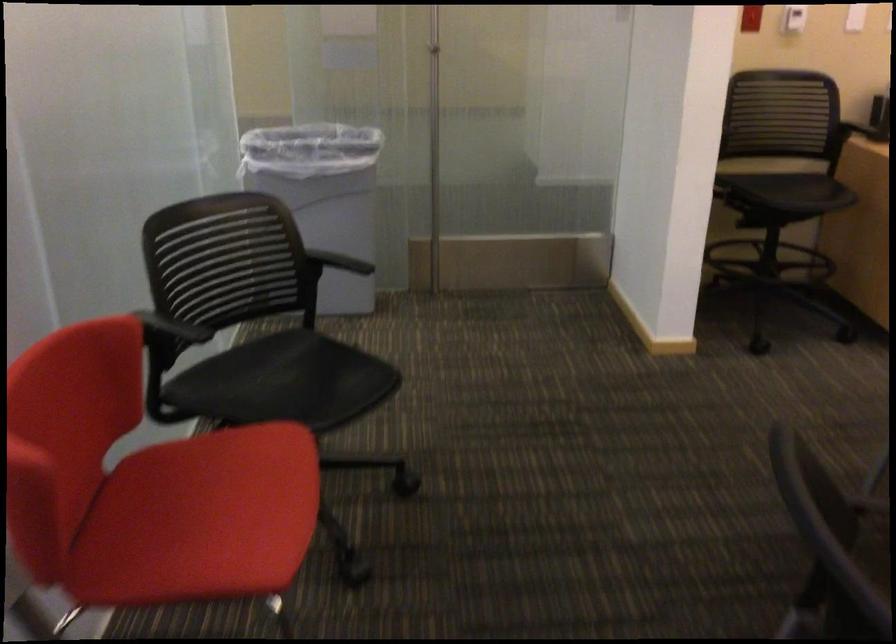
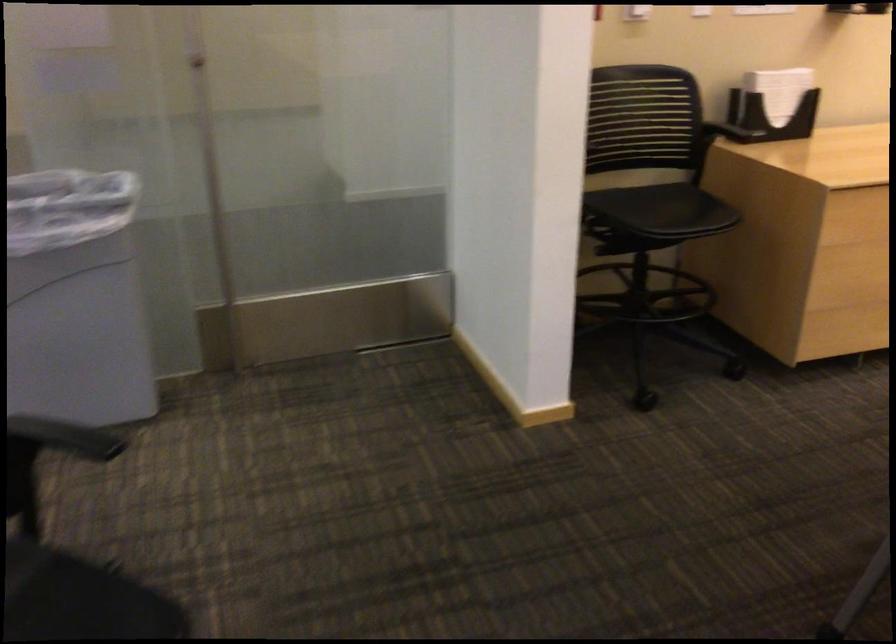
Question: Which direction would the cameraman need to move to produce the second image? Reply with the corresponding letter.

Choices:
 (A) Left
 (B) Right
 (C) Forward
 (D) Backward

Answer: (C)